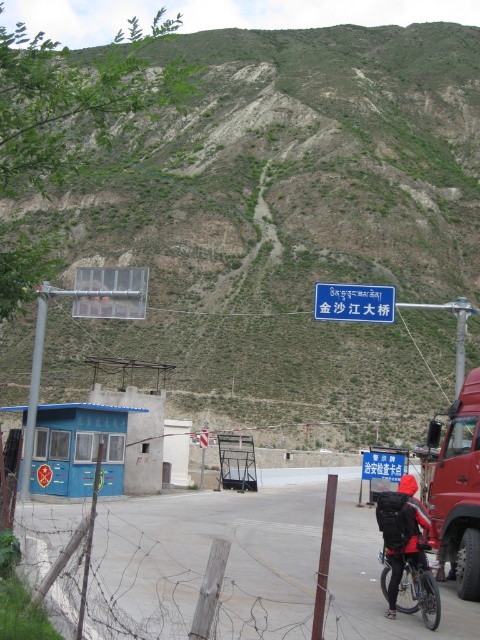
Who is higher up, blue plastic sign at center or silver metallic bicycle at lower center?

Positioned higher is blue plastic sign at center.

Is blue plastic sign at center smaller than silver metallic bicycle at lower center?

No.

Is point (372, 296) closer to viewer compared to point (381, 580)?

No, (372, 296) is further to viewer.

Image resolution: width=480 pixels, height=640 pixels. Find the location of `blue plastic sign at center`. blue plastic sign at center is located at coordinates (354, 301).

Who is higher up, red matte truck at right or silver metallic bicycle at lower center?

silver metallic bicycle at lower center

Is red matte truck at right shorter than silver metallic bicycle at lower center?

In fact, red matte truck at right may be taller than silver metallic bicycle at lower center.

Which is behind, point (456, 468) or point (412, 605)?

Point (456, 468)

The width and height of the screenshot is (480, 640). What are the coordinates of `red matte truck at right` in the screenshot? It's located at (458, 492).

Identify the location of red matte truck at right. Image resolution: width=480 pixels, height=640 pixels. (458, 492).